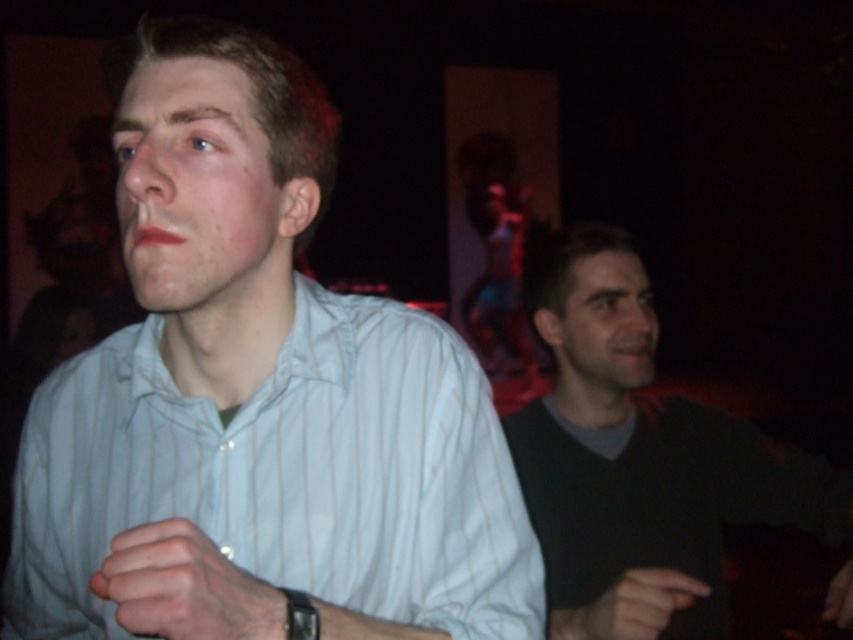
Is point (630, 628) positioned in front of point (289, 637)?

No, (630, 628) is further to viewer.

Is smooth skin hand at lower right wider than black rubber wristband at lower center?

Indeed, smooth skin hand at lower right has a greater width compared to black rubber wristband at lower center.

Does point (563, 628) come in front of point (293, 628)?

No, (563, 628) is behind (293, 628).

The width and height of the screenshot is (853, 640). Identify the location of smooth skin hand at lower right. (631, 605).

Can you confirm if white striped shirt at center is thinner than white matte ring at lower left?

No.

Does white striped shirt at center appear over white matte ring at lower left?

Yes, white striped shirt at center is above white matte ring at lower left.

Is point (318, 112) positioned after point (194, 582)?

Yes, point (318, 112) is farther from viewer.

You are a GUI agent. You are given a task and a screenshot of the screen. Output one action in this format:
    pyautogui.click(x=<x>, y=<y>)
    Task: Click on the white striped shirt at center
    This screenshot has height=640, width=853.
    Given the screenshot: What is the action you would take?
    pyautogui.click(x=256, y=401)

Which of these two, white matte ring at lower left or smooth skin hand at lower right, stands taller?

With more height is smooth skin hand at lower right.

Is white matte ring at lower left bigger than smooth skin hand at lower right?

No.

The width and height of the screenshot is (853, 640). I want to click on white matte ring at lower left, so pyautogui.click(x=184, y=586).

Identify the location of white matte ring at lower left. (184, 586).